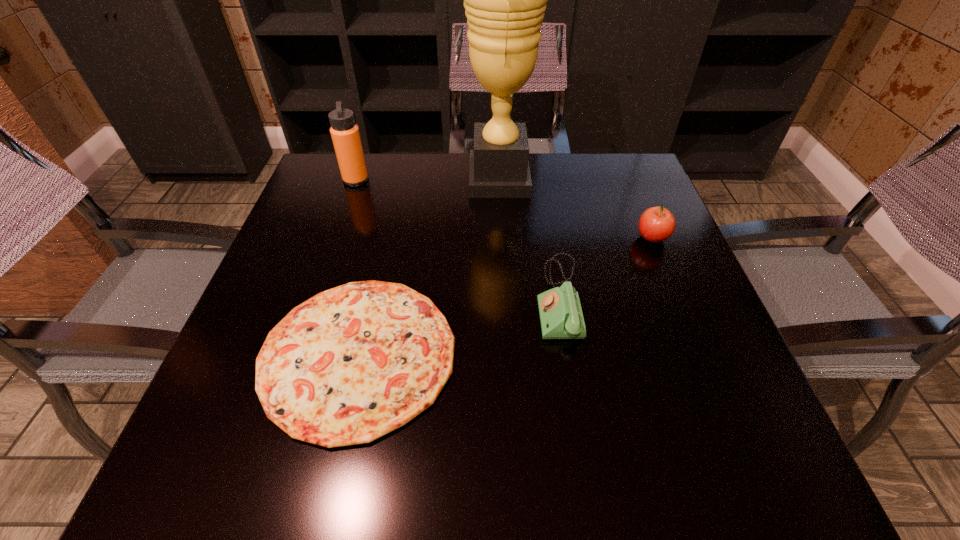
At what (x,y) coordinates should I click in order to perform the action: click on free space located 0.060m on the back of the third tallest object. Please return your answer as a coordinate pair (x, y). The width and height of the screenshot is (960, 540). Looking at the image, I should click on (641, 212).

Identify the location of blank area located 0.340m on the dial of the second shortest object. (368, 300).

The height and width of the screenshot is (540, 960). I want to click on free space located on the dial of the second shortest object, so click(x=502, y=300).

Where is `free space located 0.290m on the dial of the second shortest object`? Image resolution: width=960 pixels, height=540 pixels. free space located 0.290m on the dial of the second shortest object is located at coordinates (393, 300).

Find the location of a particular element. This screenshot has width=960, height=540. free space located 0.350m on the right of the shortest object is located at coordinates (648, 354).

At what (x,y) coordinates should I click in order to perform the action: click on trophy cup situated at the far edge. Please return your answer as a coordinate pair (x, y). Looking at the image, I should click on (505, 0).

Where is `thermos bottle present at the far edge`? thermos bottle present at the far edge is located at coordinates (345, 134).

Identify the location of object present at the near edge. (353, 363).

I want to click on thermos bottle located at the left edge, so click(345, 134).

The height and width of the screenshot is (540, 960). In order to click on pizza located at the left edge in this screenshot , I will do `click(353, 363)`.